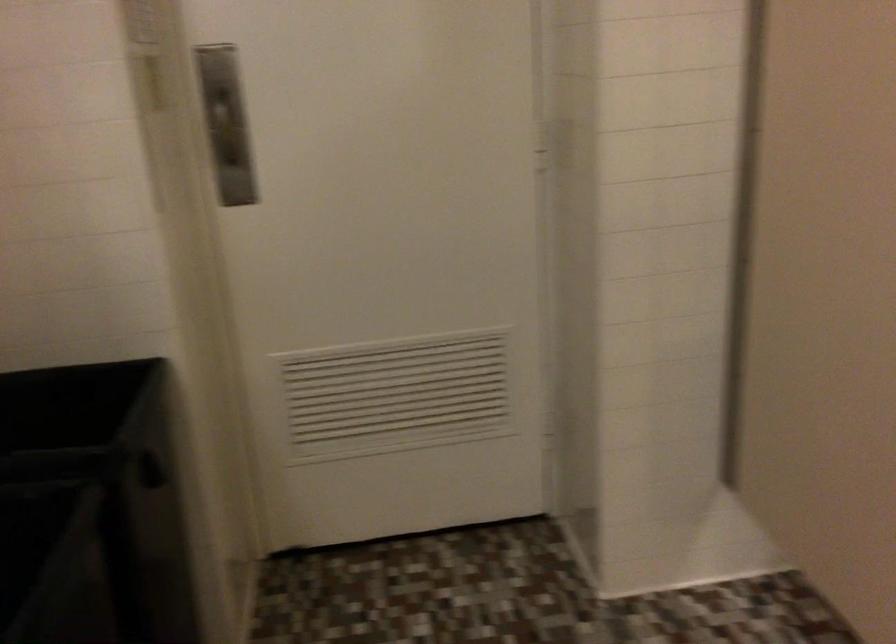
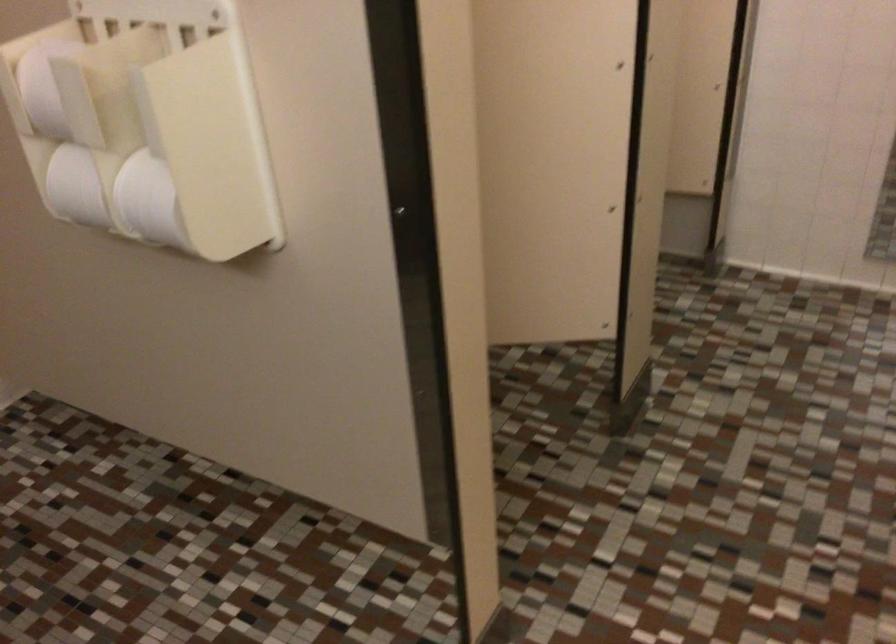
How did the camera likely rotate?

The rotation direction of the camera is right-down.